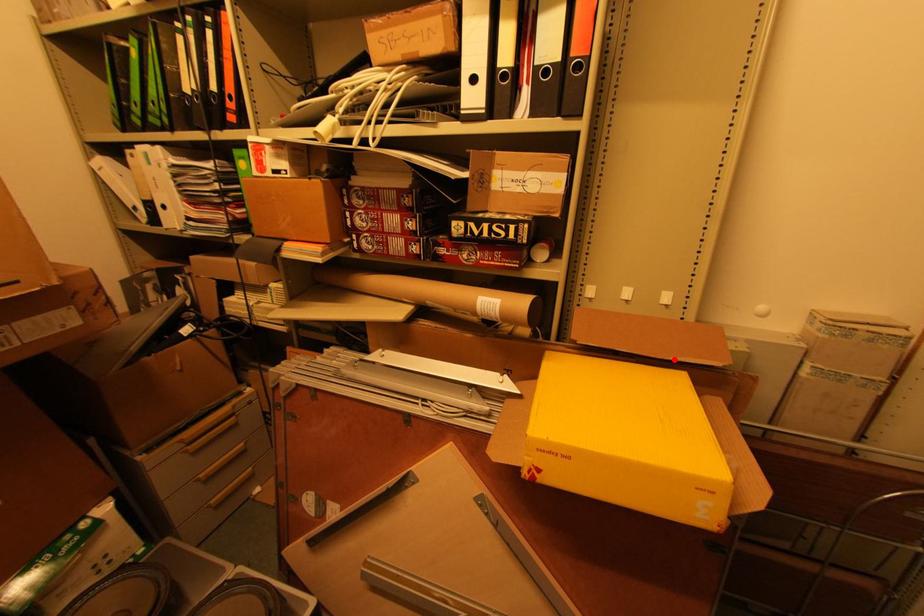
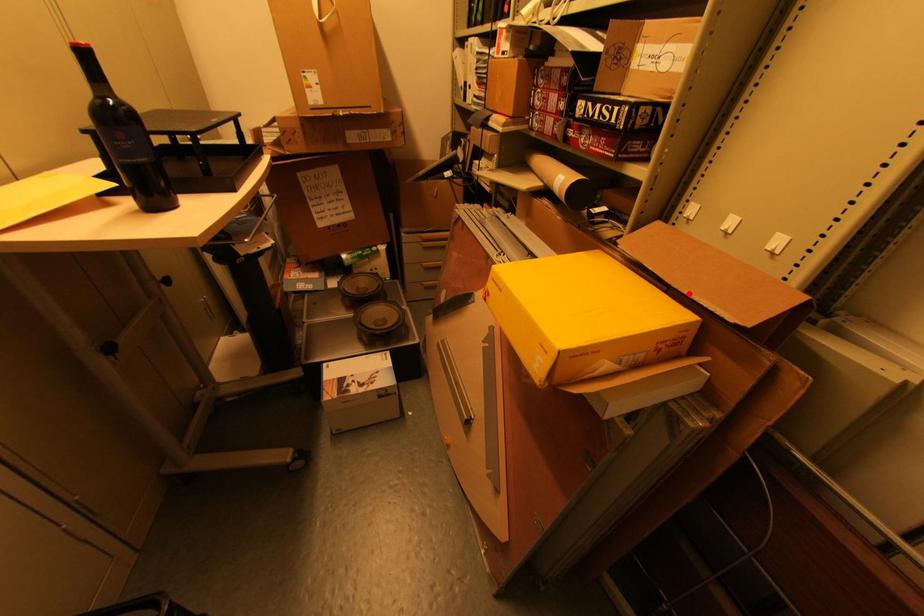
I am providing you with two images of the same scene from different viewpoints. A red point is marked on the first image and another point is marked on the second image. Are the points marked in image1 and image2 representing the same 3D position?

Yes